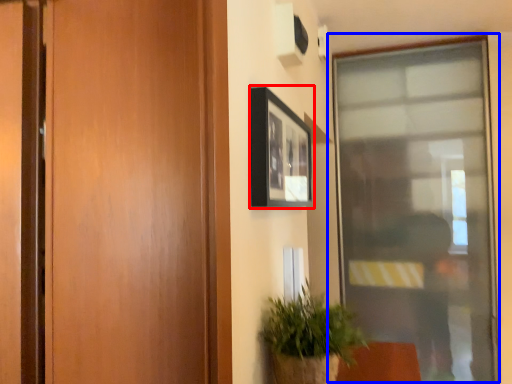
Question: Which object is further to the camera taking this photo, picture frame (highlighted by a red box) or window (highlighted by a blue box)?

Choices:
 (A) picture frame
 (B) window

Answer: (B)